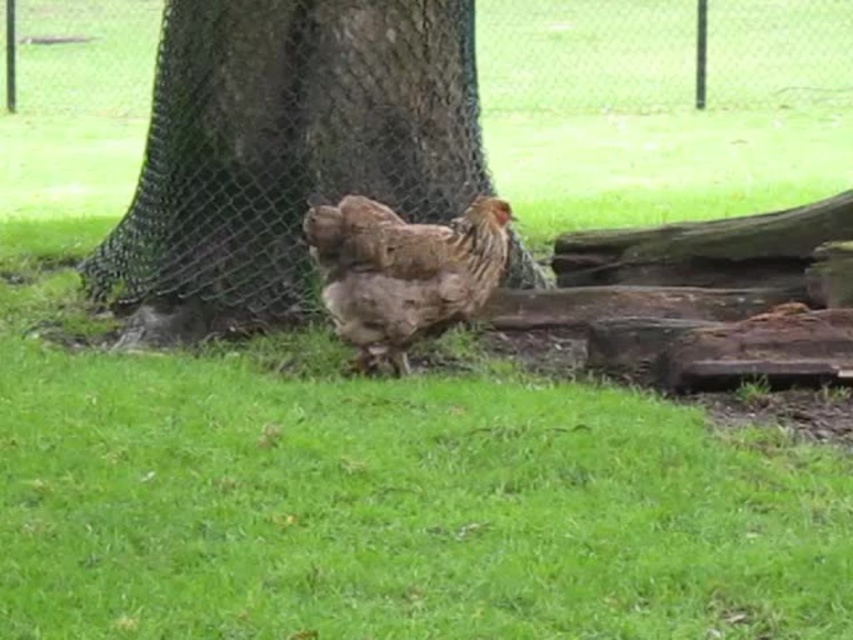
You are a gardener who needs to place a 5 meter long ladder between the brown textured tree trunk at center and the chicken. Will the ladder fit between them?

The distance between the brown textured tree trunk at center and the chicken is 4.60 meters. Since the ladder is 5 meters long, it will not fit between them as the ladder is longer than the available space.

You are a gardener trying to determine if the brown textured tree trunk at center can accommodate a protective wrap that requires the trunk to be wider than the brown feathered chicken at center. Can you confirm if the tree trunk is wide enough based on the scene?

The brown textured tree trunk at center might be wider than brown feathered chicken at center, so it is likely wide enough to accommodate the protective wrap.

You are a bird watching enthusiast observing the scene. You notice the brown textured tree trunk at center and the brown feathered chicken at center. Which object is taller?

The brown textured tree trunk at center is taller than the brown feathered chicken at center.